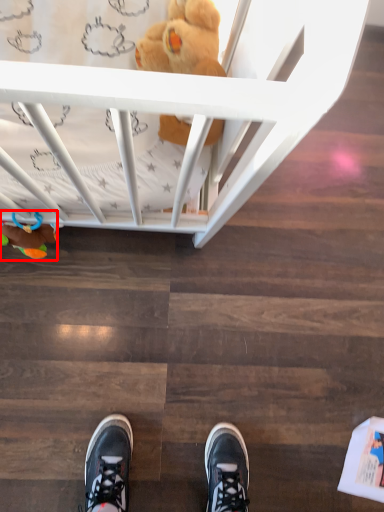
Question: From the image, what is the correct spatial relationship of toy (annotated by the red box) in relation to toy?

Choices:
 (A) left
 (B) right

Answer: (A)